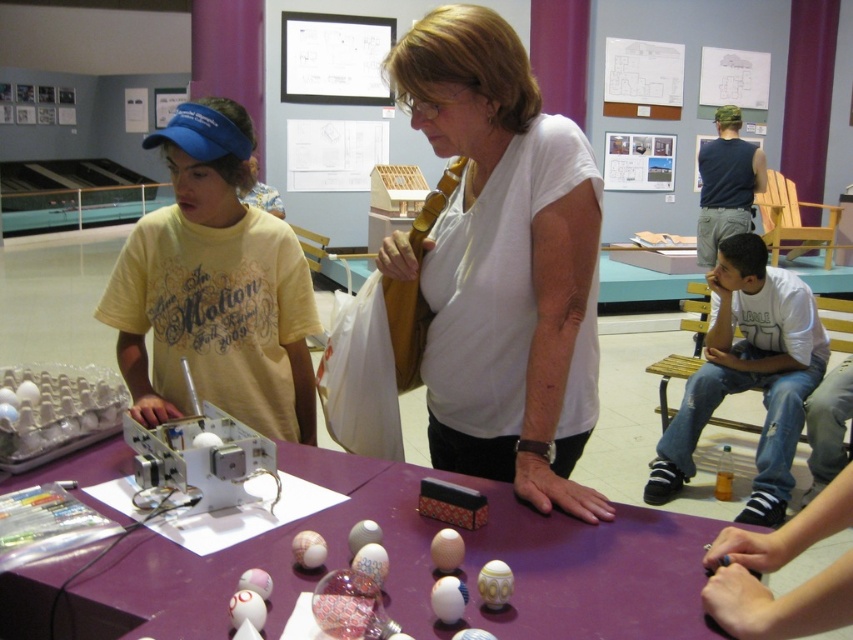
Between point (102, 476) and point (791, 381), which one is positioned in front?

Point (102, 476) is more forward.

How far apart are purple matte table at center and white cotton shirt at right?

They are 6.77 feet apart.

This screenshot has height=640, width=853. Find the location of `purple matte table at center`. purple matte table at center is located at coordinates (415, 564).

Where is `purple matte table at center`? This screenshot has height=640, width=853. purple matte table at center is located at coordinates (415, 564).

What do you see at coordinates (503, 262) in the screenshot? This screenshot has height=640, width=853. I see `white matte shirt at center` at bounding box center [503, 262].

The height and width of the screenshot is (640, 853). I want to click on white matte shirt at center, so click(503, 262).

The height and width of the screenshot is (640, 853). I want to click on white matte shirt at center, so click(x=503, y=262).

Does purple matte table at center appear on the left side of yellow cotton shirt at left?

In fact, purple matte table at center is to the right of yellow cotton shirt at left.

Where is `purple matte table at center`? Image resolution: width=853 pixels, height=640 pixels. purple matte table at center is located at coordinates (415, 564).

Describe the element at coordinates (415, 564) in the screenshot. Image resolution: width=853 pixels, height=640 pixels. I see `purple matte table at center` at that location.

Find the location of a particular element. purple matte table at center is located at coordinates (415, 564).